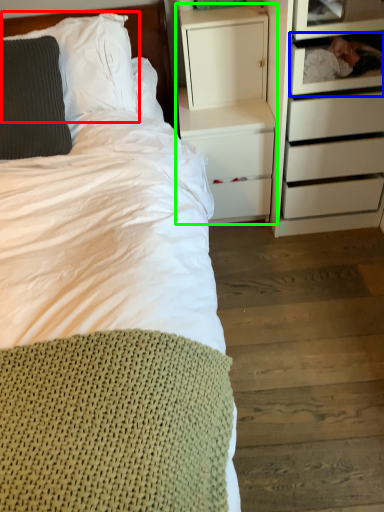
Question: Estimate the real-world distances between objects in this image. Which object is closer to pillow (highlighted by a red box), shelf (highlighted by a blue box) or nightstand (highlighted by a green box)?

Choices:
 (A) shelf
 (B) nightstand

Answer: (B)